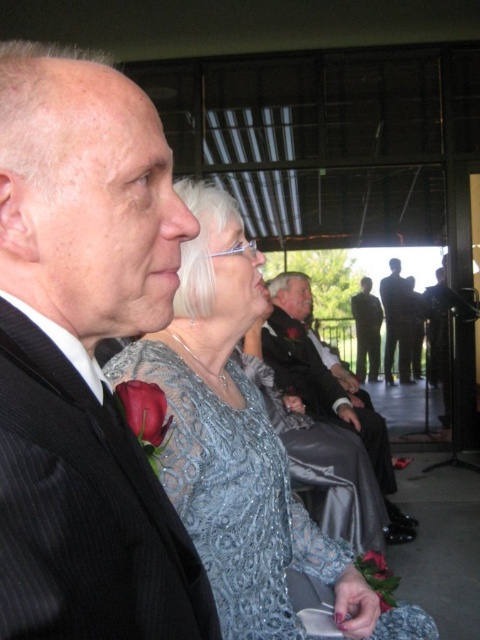
This screenshot has height=640, width=480. Describe the element at coordinates (240, 451) in the screenshot. I see `sparkly silver dress at center` at that location.

Is point (269, 550) behind point (173, 212)?

Yes, point (269, 550) is farther from viewer.

Locate an element on the screen. The image size is (480, 640). sparkly silver dress at center is located at coordinates (240, 451).

Does point (9, 422) come closer to viewer compared to point (283, 369)?

Yes, it is.

Can you confirm if black pinstripe suit at left is smaller than shiny black suit at center?

Yes.

Where is `black pinstripe suit at left`? black pinstripe suit at left is located at coordinates (84, 508).

Is black pinstripe suit at left wider than silky black suit at center?

Incorrect, black pinstripe suit at left's width does not surpass silky black suit at center's.

Is black pinstripe suit at left closer to the viewer compared to silky black suit at center?

Yes, black pinstripe suit at left is in front of silky black suit at center.

Locate an element on the screen. The image size is (480, 640). black pinstripe suit at left is located at coordinates (84, 508).

At what (x,y) coordinates should I click in order to perform the action: click on black pinstripe suit at left. Please return your answer as a coordinate pair (x, y). The width and height of the screenshot is (480, 640). Looking at the image, I should click on (84, 508).